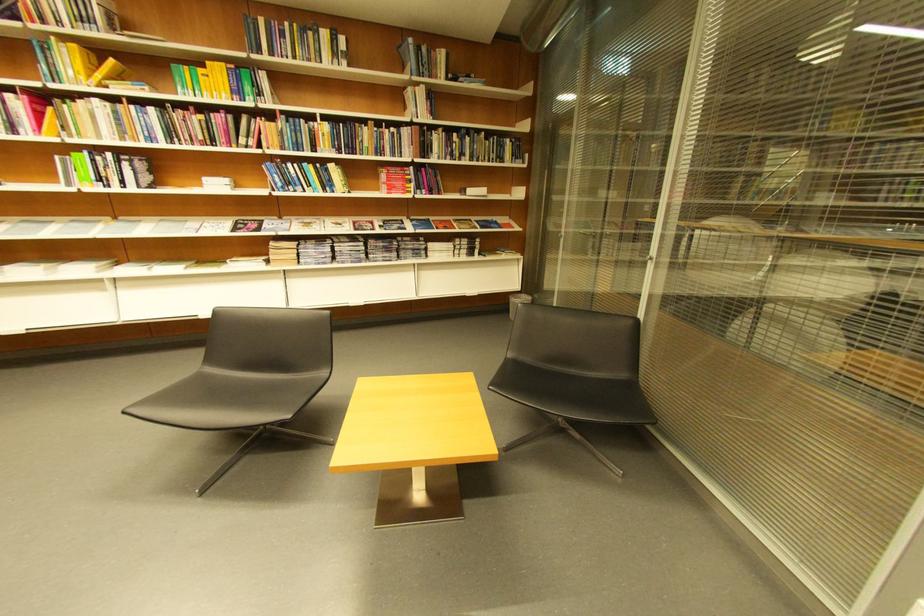
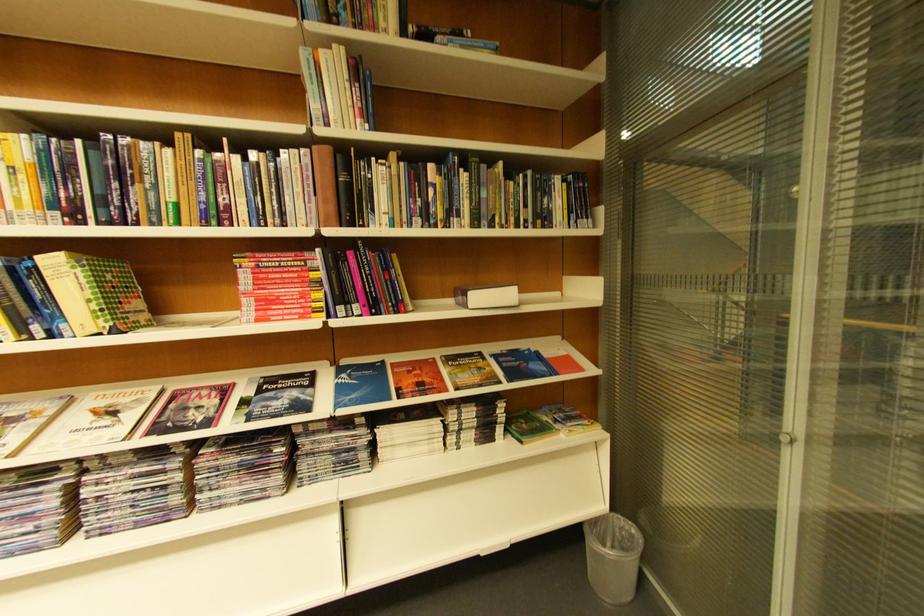
Locate, in the second image, the point that corresponds to [342,168] in the first image.

(63, 264)